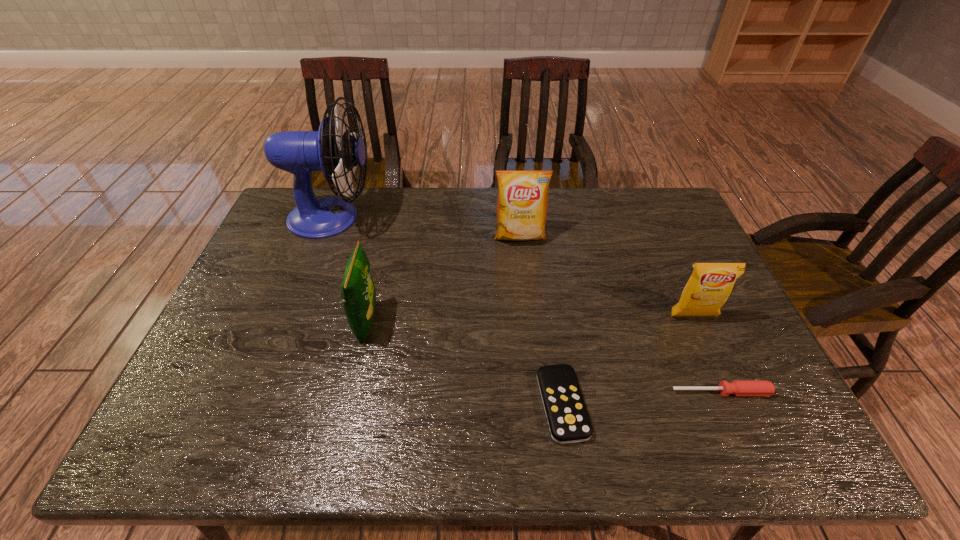
Locate an element on the screen. free space that is in between the remote control and the rightmost crisp (potato chip) is located at coordinates (628, 361).

Locate an element on the screen. vacant space that is in between the tallest object and the remote control is located at coordinates (447, 311).

Image resolution: width=960 pixels, height=540 pixels. What are the coordinates of `unoccupied position between the farthest crisp (potato chip) and the screwdriver` in the screenshot? It's located at (620, 314).

Identify which object is the second nearest to the screwdriver. Please provide its 2D coordinates. Your answer should be formatted as a tuple, i.e. [(x, y)], where the tuple contains the x and y coordinates of a point satisfying the conditions above.

[(568, 420)]

Locate an element on the screen. the fifth closest object to the rightmost crisp (potato chip) is located at coordinates (333, 150).

Where is `the closest crisp (potato chip) relative to the leftmost object`? This screenshot has height=540, width=960. the closest crisp (potato chip) relative to the leftmost object is located at coordinates (358, 292).

Locate an element on the screen. The image size is (960, 540). crisp (potato chip) that is the third closest to the fan is located at coordinates (708, 288).

At what (x,y) coordinates should I click in order to perform the action: click on vacant position in the image that satisfies the following two spatial constraints: 1. in front of the leftmost object where the airflow is directed; 2. on the right side of the screwdriver. Please return your answer as a coordinate pair (x, y). The image size is (960, 540). Looking at the image, I should click on (265, 392).

The height and width of the screenshot is (540, 960). I want to click on vacant space that satisfies the following two spatial constraints: 1. in front of the leftmost object where the airflow is directed; 2. on the right side of the screwdriver, so click(265, 392).

Image resolution: width=960 pixels, height=540 pixels. Identify the location of vacant space that satisfies the following two spatial constraints: 1. on the front-facing side of the leftmost crisp (potato chip); 2. on the right side of the remote control. (348, 404).